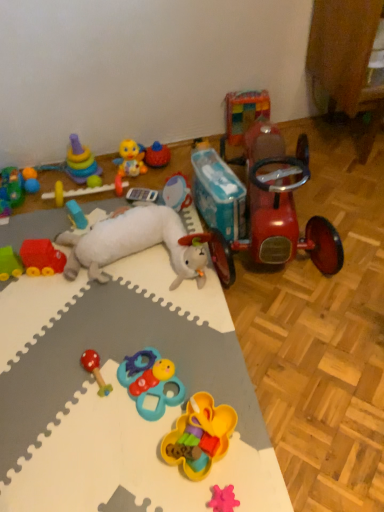
Locate an element on the screen. This screenshot has width=384, height=512. spots to the right of wooden/matte rattle at lower left, acting as the fifth toy starting from the left is located at coordinates (161, 355).